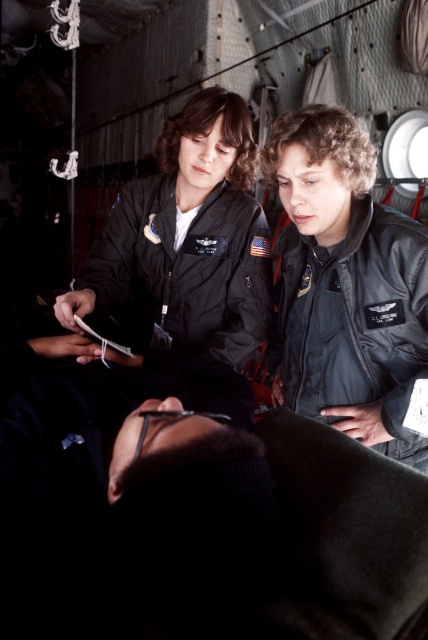
Question: Where is black leather jacket at center located in relation to matte black flight suit at center in the image?

Choices:
 (A) right
 (B) left

Answer: (A)

Question: Which of the following is the farthest from the observer?

Choices:
 (A) black leather jacket at center
 (B) matte black flight suit at center

Answer: (B)

Question: Is black leather jacket at center positioned before matte black flight suit at center?

Choices:
 (A) yes
 (B) no

Answer: (A)

Question: Observing the image, what is the correct spatial positioning of black leather jacket at center in reference to matte black flight suit at center?

Choices:
 (A) above
 (B) below

Answer: (B)

Question: Which point is closer to the camera?

Choices:
 (A) matte black flight suit at center
 (B) black leather jacket at center

Answer: (B)